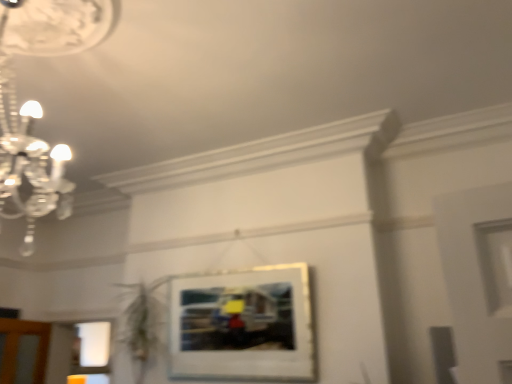
I want to click on white matte picture frame at center, so click(243, 325).

This screenshot has width=512, height=384. Describe the element at coordinates (243, 325) in the screenshot. I see `white matte picture frame at center` at that location.

In order to face white matte picture frame at center, should I rotate leftwards or rightwards?

Turn left by 3.023 degrees to look at white matte picture frame at center.

This screenshot has height=384, width=512. What are the coordinates of `white matte picture frame at center` in the screenshot? It's located at (243, 325).